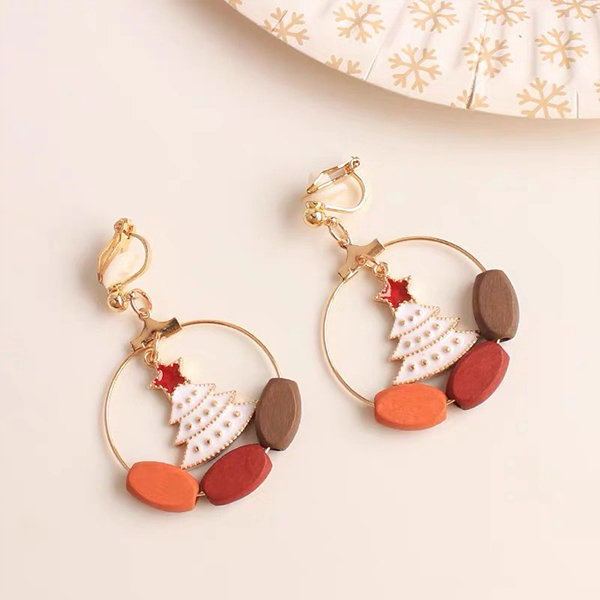
This screenshot has height=600, width=600. I want to click on white christmas tree, so click(442, 338).